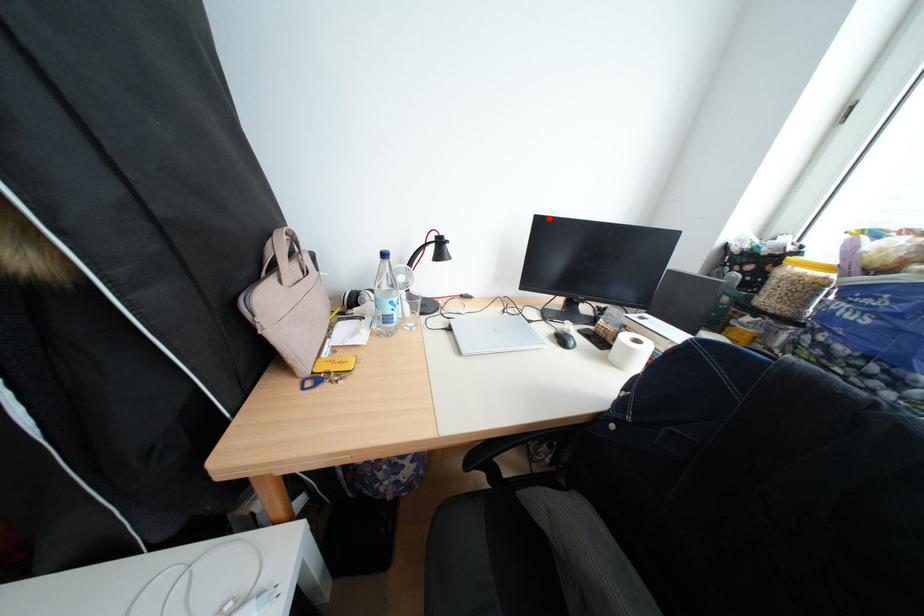
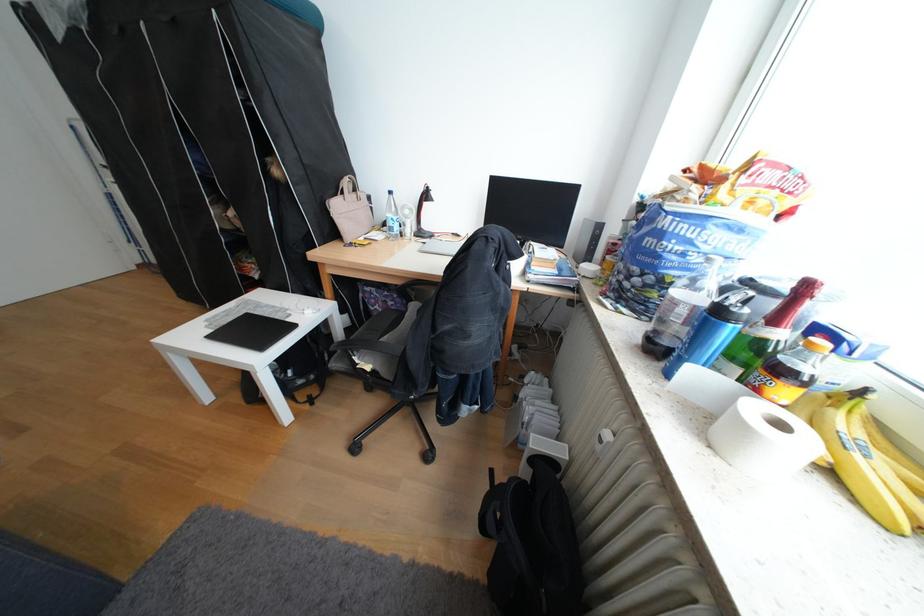
Question: A red point is marked in image1. In image2, is the corresponding 3D point closer to the camera or farther? Reply with the corresponding letter.

Choices:
 (A) The corresponding 3D point is closer.
 (B) The corresponding 3D point is farther.

Answer: (A)